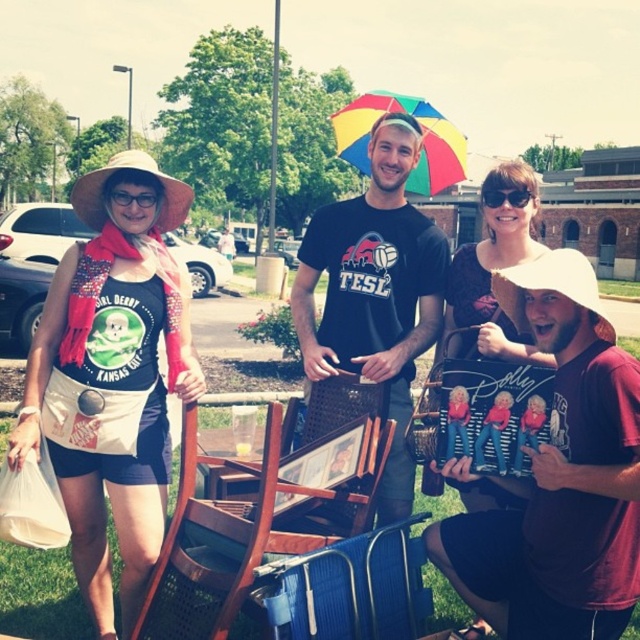
You are standing at the center of the image and want to hand a flyer to the person wearing the maroon cotton shirt at lower right. In which direction should you move to reach them?

The maroon cotton shirt at lower right is located at point (560, 477), so you should move towards the lower right direction to reach them.